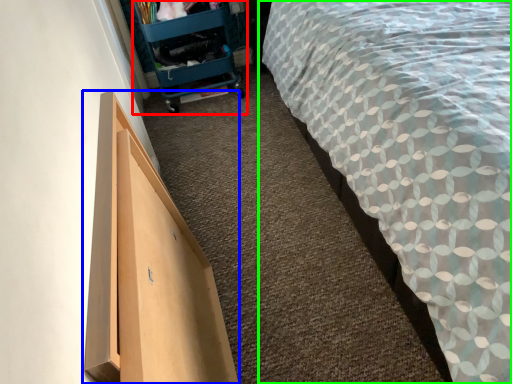
Question: Considering the real-world distances, which object is farthest from trolley (highlighted by a red box)? furniture (highlighted by a blue box) or bed (highlighted by a green box)?

Choices:
 (A) furniture
 (B) bed

Answer: (A)